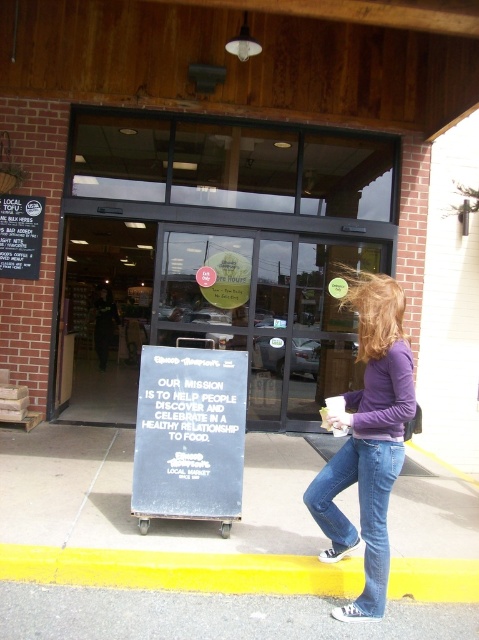
You are standing at the entrance of the Local Market and want to place a new sign on the ground. The sign must be placed between the two points provided. However, you need to ensure that the sign doesn not block the path to the door. Given that the door is located at the center of the entrance, can you determine if placing the sign between point (55,538) and point (380,529) will block the door? Please explain your reasoning using the coordinates provided.

Point (55,538) is behind point (380,529). Since the door is at the center of the entrance, placing the sign between these two points would likely block the path to the door because the points are positioned in front of the door.

You are a delivery person approaching the entrance of the brick building. You need to place a heavy box on the ground near the clear glass storefront at center. Is the gray asphalt at lower center a suitable surface for placing the box?

The clear glass storefront at center is located above gray asphalt at lower center, so the gray asphalt at lower center is the ground surface below the glass storefront. Since asphalt is a solid and stable surface, it is suitable for placing a heavy box near the clear glass storefront at center.